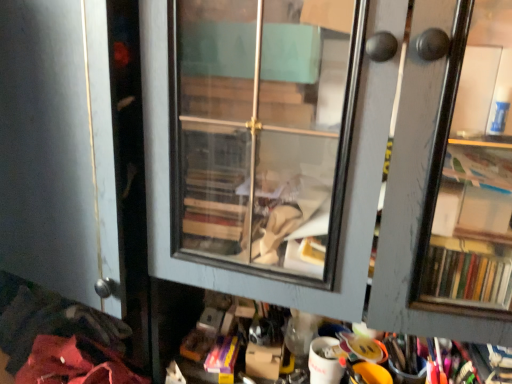
Measure the distance between point (x=74, y=226) and camera.

35.31 inches.

At what (x,y) coordinates should I click in order to perform the action: click on matte gray cabinet at left. Please return your answer as a coordinate pair (x, y). Looking at the image, I should click on (58, 149).

What do you see at coordinates (58, 149) in the screenshot?
I see `matte gray cabinet at left` at bounding box center [58, 149].

Find the location of a particular element. The image size is (512, 384). matte gray cabinet at left is located at coordinates (58, 149).